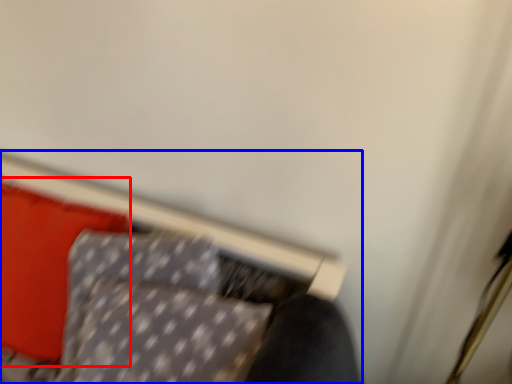
Question: Which object appears closest to the camera in this image, pillow (highlighted by a red box) or furniture (highlighted by a blue box)?

Choices:
 (A) pillow
 (B) furniture

Answer: (B)